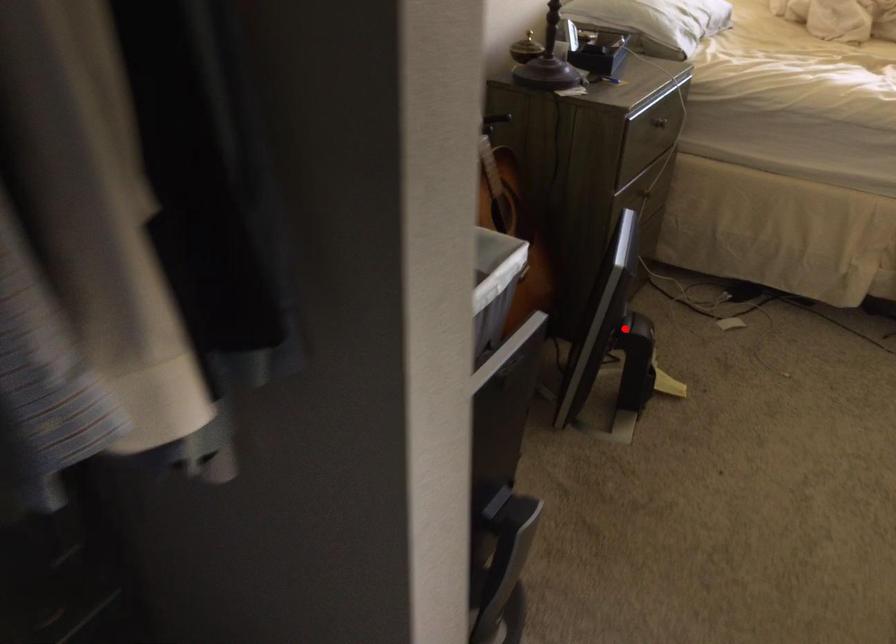
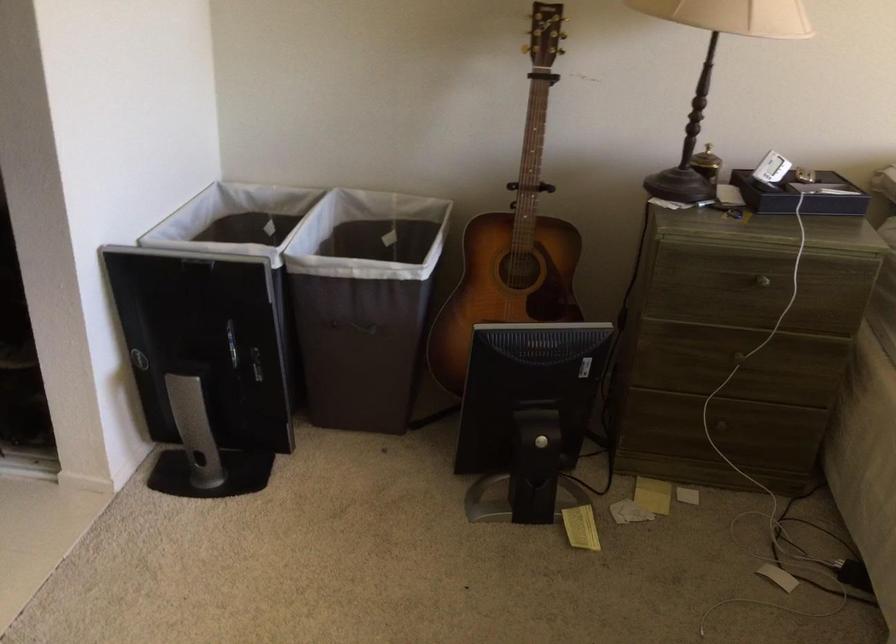
Question: I am providing you with two images of the same scene from different viewpoints. A red point is marked on the first image. Can you still see the location of the red point in image 2?

Choices:
 (A) Yes
 (B) No

Answer: (A)